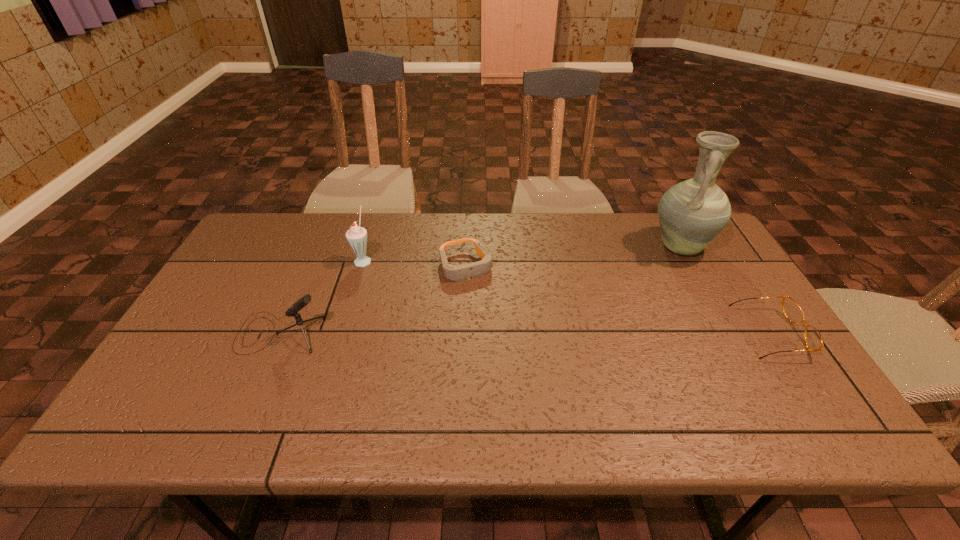
Find the location of a particular element. The image size is (960, 540). vacant spot on the desktop that is between the leftmost object and the spectacles and is positioned on the handle side of the pitcher is located at coordinates (574, 333).

Image resolution: width=960 pixels, height=540 pixels. In order to click on free space on the desktop that is between the microphone and the spectacles and is positioned on the straw side of the fourth shortest object in this screenshot , I will do `click(521, 333)`.

This screenshot has height=540, width=960. In order to click on vacant spot on the desktop that is between the leftmost object and the spectacles and is positioned on the front and back of the third object from right to left in this screenshot , I will do `click(501, 333)`.